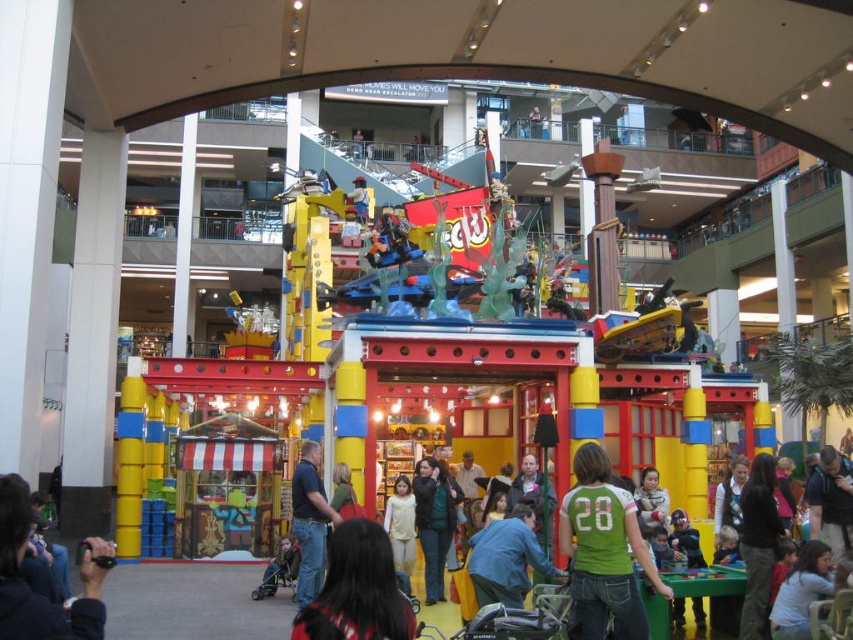
You are a photographer trying to capture a clear shot of the blue jeans at center and the green matte jacket at center. Since you want both subjects to be in focus, which one should you focus on first to ensure the other is also sharp?

The blue jeans at center is positioned over green matte jacket at center, so focusing on the blue jeans at center first will ensure the green matte jacket at center is also in focus due to its closer proximity to the camera.

You are a photographer at the Lego exhibit. You need to capture a photo that includes both the blue jeans at center and the green matte jacket at center. Which object should you focus on first to ensure both are in frame?

→ The blue jeans at center is taller than the green matte jacket at center, so you should focus on the blue jeans at center first to ensure the entire height of both objects is captured in the frame.